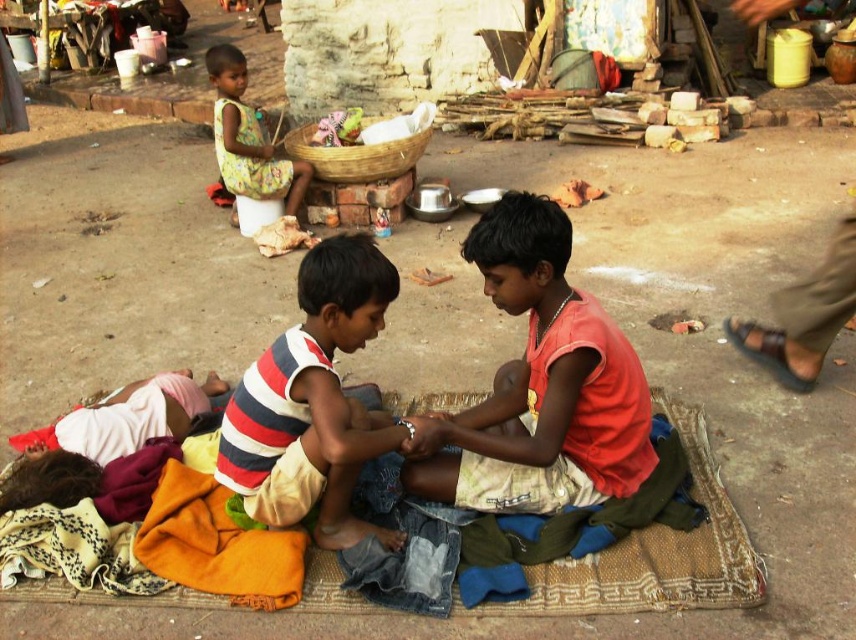
Is orange cotton shirt at center further to the viewer compared to printed fabric dress at upper left?

No, orange cotton shirt at center is closer to the viewer.

Is point (513, 296) less distant than point (287, 200)?

Yes, point (513, 296) is in front of point (287, 200).

Where is `orange cotton shirt at center`? orange cotton shirt at center is located at coordinates (539, 385).

Between orange cotton shirt at center and striped fabric shirt at center, which one is positioned higher?

orange cotton shirt at center is higher up.

Measure the distance between point (x=521, y=460) and camera.

Point (x=521, y=460) and camera are 8.70 feet apart.

Is point (603, 372) closer to camera compared to point (293, 480)?

Yes, it is in front of point (293, 480).

This screenshot has height=640, width=856. I want to click on orange cotton shirt at center, so click(539, 385).

Which of these two, orange cotton shirt at center or woven fabric mat at center, stands shorter?

woven fabric mat at center

Who is more distant from viewer, [625,346] or [741,580]?

Point [625,346]

This screenshot has height=640, width=856. In order to click on orange cotton shirt at center in this screenshot , I will do `click(539, 385)`.